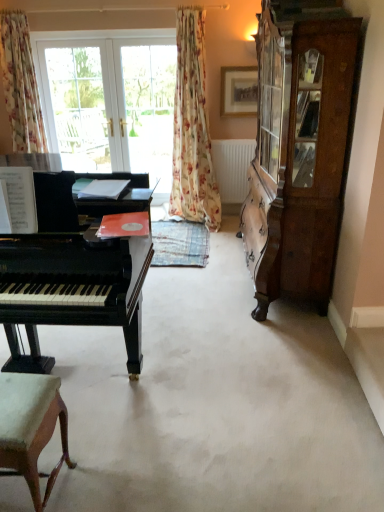
Question: Should I look upward or downward to see transparent glass door at upper center, which appears as the 2th screen door when viewed from the left?

Choices:
 (A) down
 (B) up

Answer: (B)

Question: From the image's perspective, does shiny black piano at left appear higher than white matte radiator at center?

Choices:
 (A) yes
 (B) no

Answer: (B)

Question: Is shiny black piano at left wider than white matte radiator at center?

Choices:
 (A) yes
 (B) no

Answer: (A)

Question: Is shiny black piano at left taller than white matte radiator at center?

Choices:
 (A) no
 (B) yes

Answer: (B)

Question: Can you confirm if shiny black piano at left is bigger than white matte radiator at center?

Choices:
 (A) no
 (B) yes

Answer: (B)

Question: Is shiny black piano at left positioned beyond the bounds of white matte radiator at center?

Choices:
 (A) no
 (B) yes

Answer: (B)

Question: Can you confirm if shiny black piano at left is shorter than white matte radiator at center?

Choices:
 (A) no
 (B) yes

Answer: (A)

Question: Does white matte radiator at center have a lesser width compared to transparent glass door at upper left, marked as the first screen door in a left-to-right arrangement?

Choices:
 (A) no
 (B) yes

Answer: (A)

Question: From the image's perspective, is white matte radiator at center over transparent glass door at upper left, marked as the first screen door in a left-to-right arrangement?

Choices:
 (A) no
 (B) yes

Answer: (A)

Question: Is white matte radiator at center facing towards transparent glass door at upper left, marked as the first screen door in a left-to-right arrangement?

Choices:
 (A) no
 (B) yes

Answer: (A)

Question: Is white matte radiator at center touching transparent glass door at upper left, marked as the first screen door in a left-to-right arrangement?

Choices:
 (A) yes
 (B) no

Answer: (B)

Question: Is transparent glass door at upper left, positioned as the second screen door in right-to-left order, located within white matte radiator at center?

Choices:
 (A) yes
 (B) no

Answer: (B)

Question: Is white matte radiator at center to the left of transparent glass door at upper left, marked as the first screen door in a left-to-right arrangement, from the viewer's perspective?

Choices:
 (A) yes
 (B) no

Answer: (B)

Question: Considering the relative sizes of light brown wood chair at lower left and floral fabric curtain at left, which is counted as the 1th curtain, starting from the left, in the image provided, is light brown wood chair at lower left taller than floral fabric curtain at left, which is counted as the 1th curtain, starting from the left,?

Choices:
 (A) yes
 (B) no

Answer: (B)